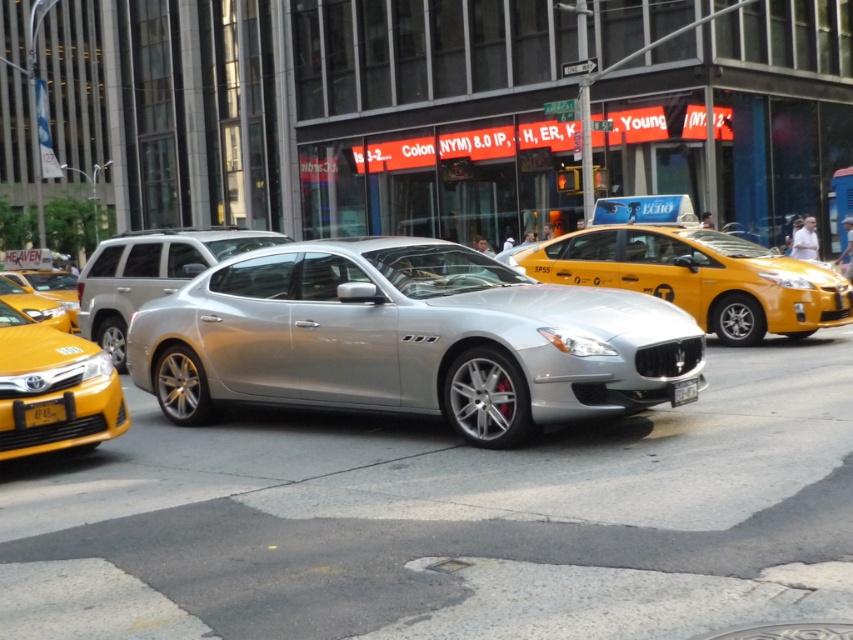
Is silver metallic sedan at center shorter than black plastic license plate at center?

No, silver metallic sedan at center is not shorter than black plastic license plate at center.

Does point (212, 228) come farther from viewer compared to point (672, 387)?

Yes, point (212, 228) is farther from viewer.

The image size is (853, 640). In order to click on silver metallic sedan at center in this screenshot , I will do `click(149, 273)`.

Is point (619, 259) less distant than point (126, 253)?

That is True.

Who is lower down, yellow matte taxi at center or silver metallic sedan at center?

yellow matte taxi at center

The height and width of the screenshot is (640, 853). Find the location of `yellow matte taxi at center`. yellow matte taxi at center is located at coordinates point(693,269).

Identify the location of silver metallic car at center. This screenshot has height=640, width=853. (407, 339).

Which is behind, point (641, 410) or point (634, 240)?

Positioned behind is point (634, 240).

Identify the location of silver metallic car at center. (407, 339).